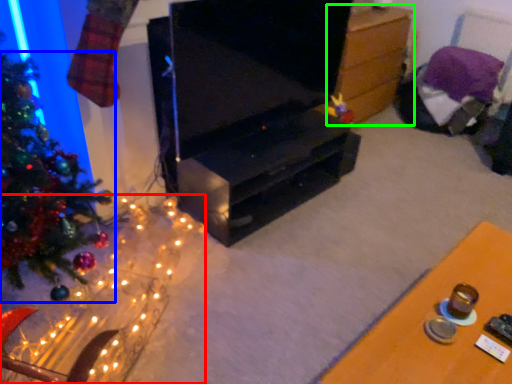
Question: Considering the real-world distances, which object is closest to christmas decoration (highlighted by a red box)? christmas tree (highlighted by a blue box) or table (highlighted by a green box).

Choices:
 (A) christmas tree
 (B) table

Answer: (A)